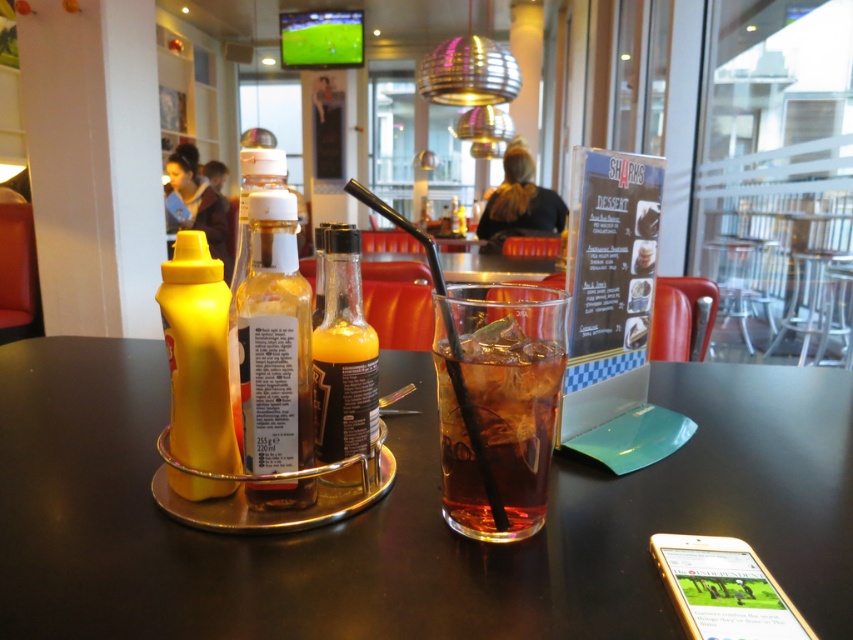
You are a customer at the sports bar and want to grab the translucent glass at center and the yellow matte squeeze bottle at left. Which item will you reach first if you move your hand towards them?

The translucent glass at center will be reached first because it is closer to the viewer than the yellow matte squeeze bottle at left.

You are a server at the sports bar and need to place a new drink order on the table. The drink is taller than the existing translucent plastic bottle at center. Can you fit it on the shiny black table at center without it falling over?

The shiny black table at center has a lesser height compared to the translucent plastic bottle at center, meaning the table is shorter than the bottle. Since the new drink is even taller than the bottle, it might not be stable on the table and could tip over due to the table being too low to provide adequate support.

You are a server at the sports bar and need to place a new order of drinks on the table. The drinks are in a large tray that takes up most of the table space. Considering the shiny black table at center and the translucent plastic bottle at center, which object will you have to move to make space?

Since the shiny black table at center is larger than the translucent plastic bottle at center, you would need to move the translucent plastic bottle at center to make space for the drinks.